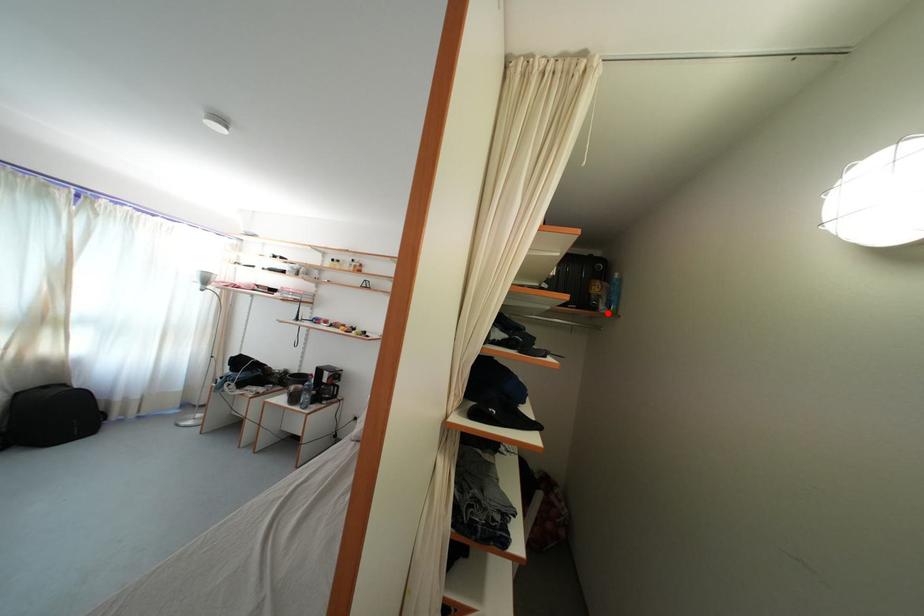
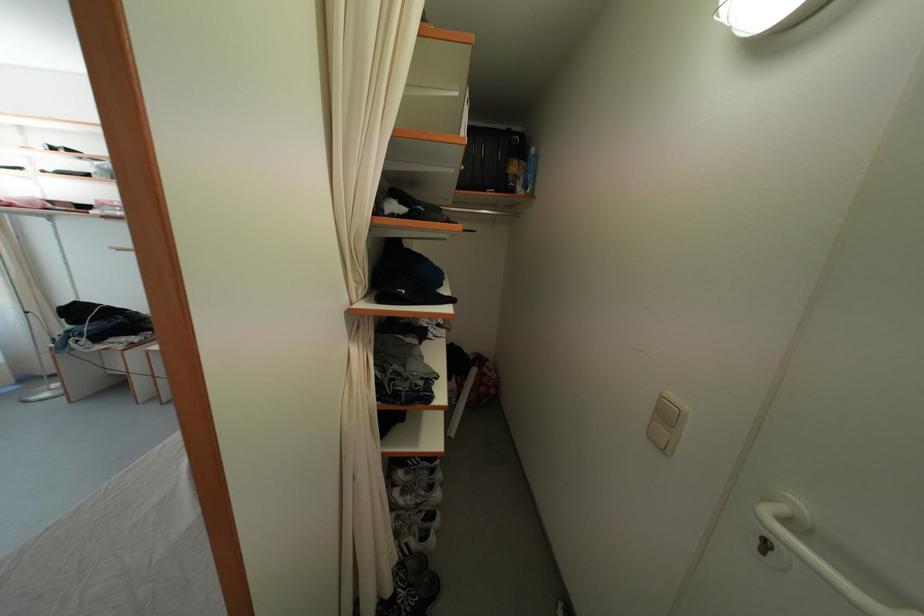
The point at the highlighted location is marked in the first image. Where is the corresponding point in the second image?

(525, 195)